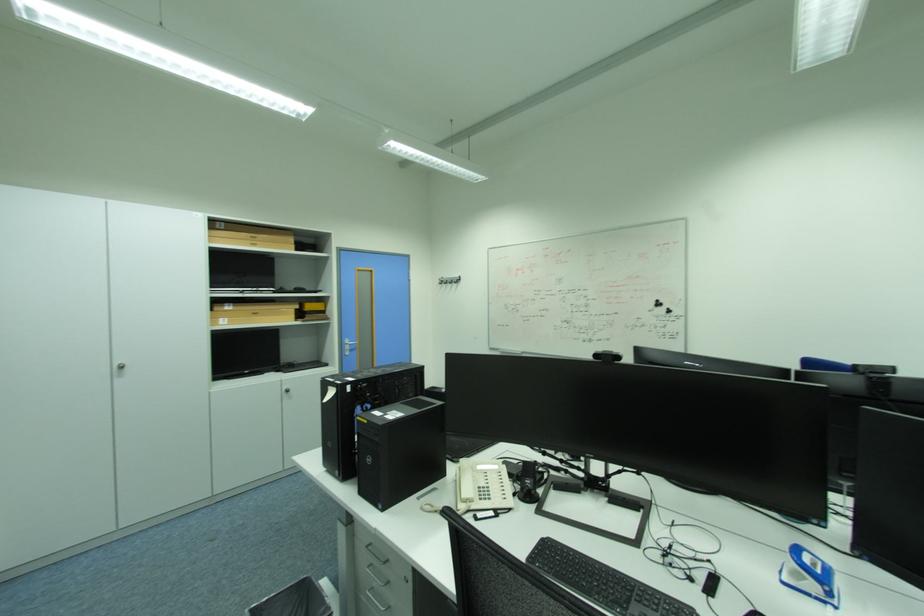
This screenshot has width=924, height=616. Describe the element at coordinates (349, 342) in the screenshot. I see `a silver door handle` at that location.